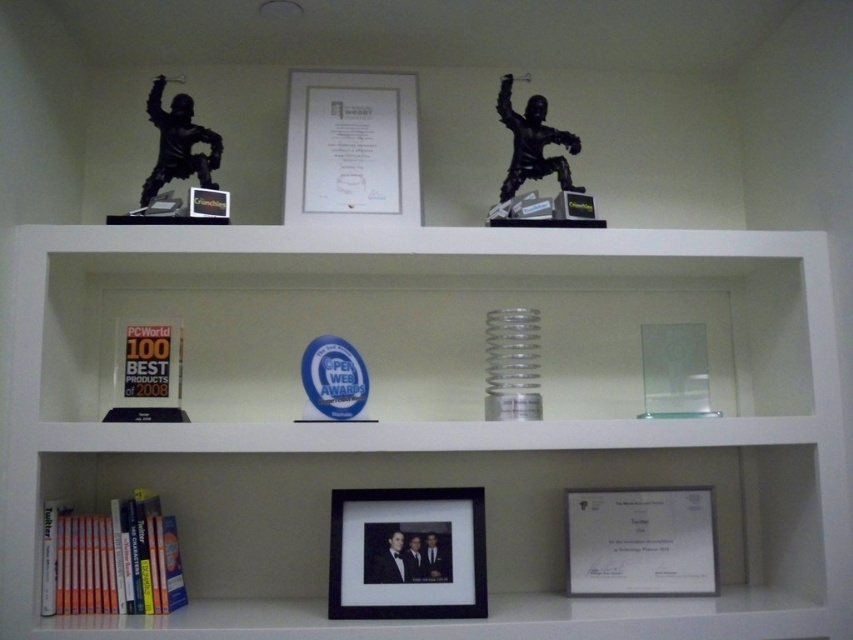
Question: Which point appears farthest from the camera in this image?

Choices:
 (A) (74, 580)
 (B) (216, 577)

Answer: (B)

Question: Among these objects, which one is nearest to the camera?

Choices:
 (A) black matte statue at upper left
 (B) black matte statue at upper center
 (C) white plastic shelf at upper center

Answer: (C)

Question: Considering the real-world distances, which object is farthest from the black matte picture frame at center?

Choices:
 (A) black matte statue at upper center
 (B) white plastic shelf at upper center
 (C) black matte statue at upper left

Answer: (C)

Question: Does white plastic shelf at upper center have a smaller size compared to black matte statue at upper center?

Choices:
 (A) yes
 (B) no

Answer: (B)

Question: From the image, what is the correct spatial relationship of white paper certificate at lower center in relation to black matte statue at upper center?

Choices:
 (A) left
 (B) right

Answer: (B)

Question: Can you confirm if white plastic shelf at upper center is positioned to the left of black matte picture frame at center?

Choices:
 (A) no
 (B) yes

Answer: (A)